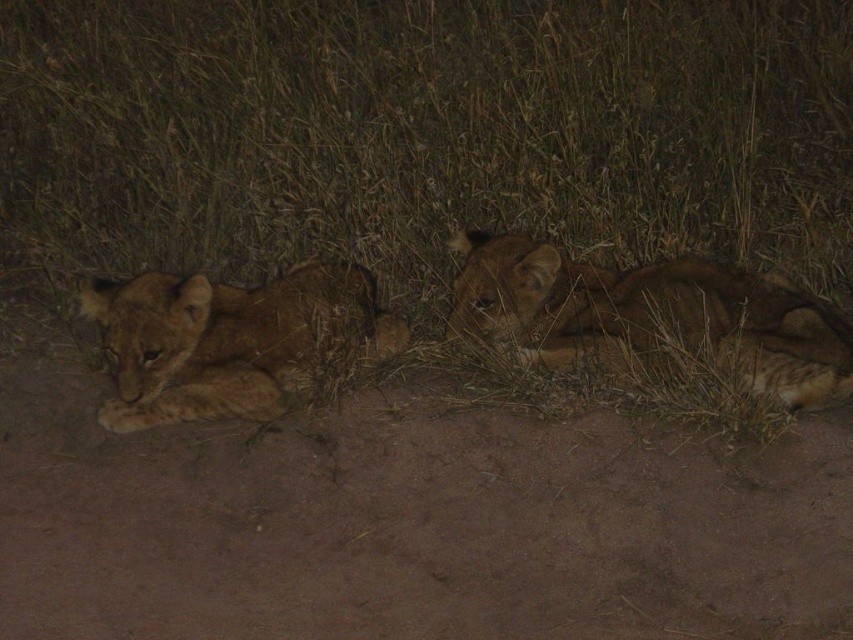
Who is positioned more to the left, golden fur lion cub at center or golden fur lion cub at left?

From the viewer's perspective, golden fur lion cub at left appears more on the left side.

Locate an element on the screen. The width and height of the screenshot is (853, 640). golden fur lion cub at center is located at coordinates (651, 316).